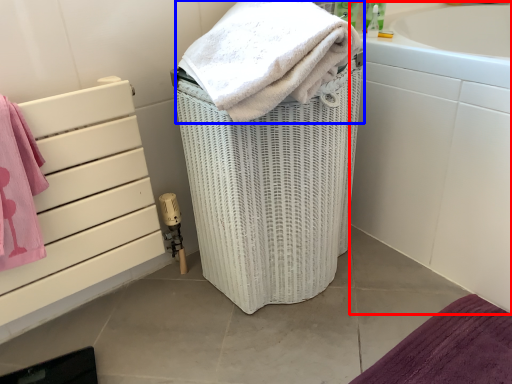
Question: Which of the following is the closest to the observer, bath (highlighted by a red box) or towel (highlighted by a blue box)?

Choices:
 (A) bath
 (B) towel

Answer: (B)